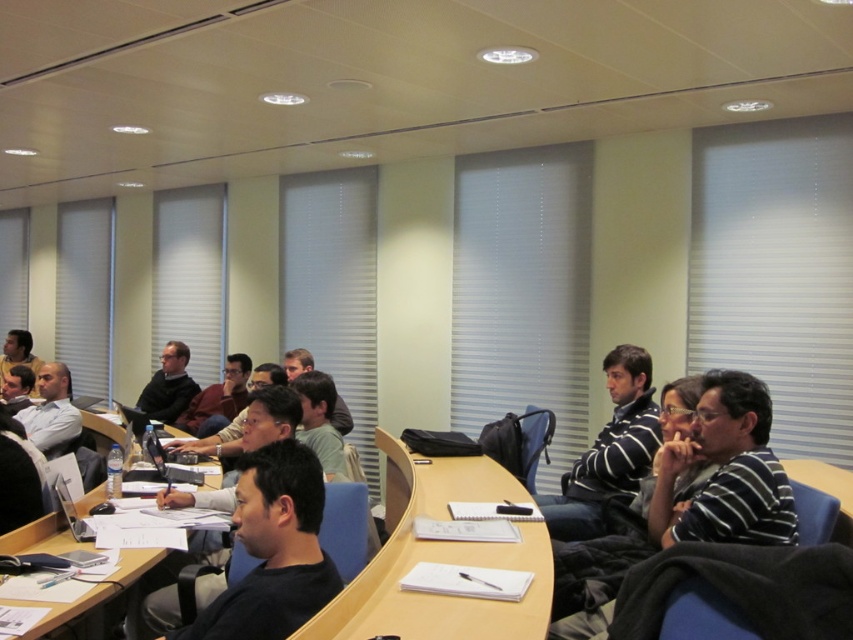
Is point (73, 416) positioned before point (152, 412)?

Yes, point (73, 416) is closer to viewer.

Who is more forward, (26, 422) or (198, 392)?

Point (26, 422) is in front.

Is point (42, 378) closer to camera compared to point (140, 392)?

Yes, point (42, 378) is in front of point (140, 392).

Identify the location of matte white shirt at center. The image size is (853, 640). (51, 412).

Describe the element at coordinates (691, 497) in the screenshot. The width and height of the screenshot is (853, 640). I see `striped cotton shirt at center` at that location.

Does striped cotton shirt at center have a smaller size compared to matte black laptop at left?

No, striped cotton shirt at center is not smaller than matte black laptop at left.

Who is more forward, (587, 564) or (9, 340)?

Point (587, 564) is in front.

Locate an element on the screen. striped cotton shirt at center is located at coordinates (691, 497).

Between point (419, 545) and point (165, 404), which one is positioned behind?

The point (165, 404) is behind.

This screenshot has height=640, width=853. Describe the element at coordinates (440, 561) in the screenshot. I see `wooden at center` at that location.

This screenshot has width=853, height=640. What are the coordinates of `wooden at center` in the screenshot? It's located at (440, 561).